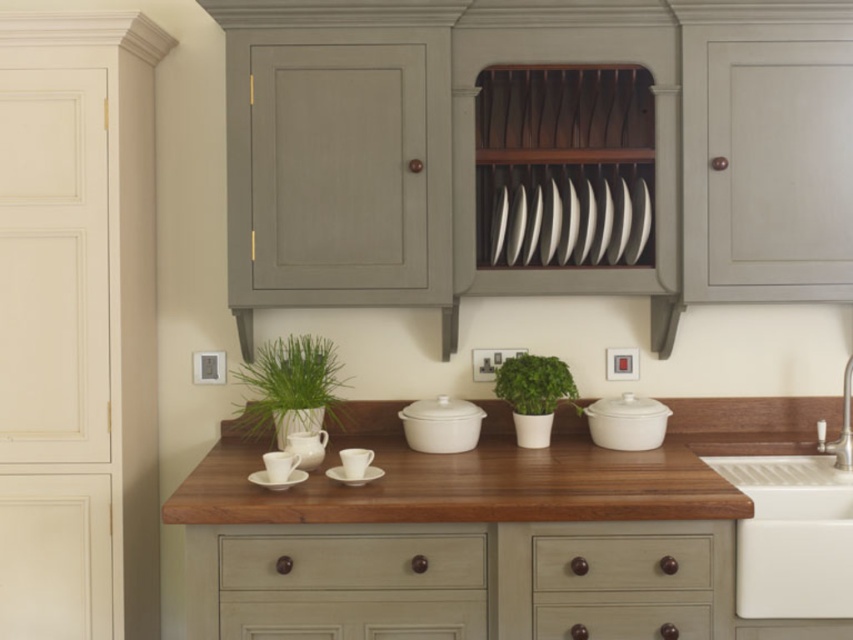
Locate an element on the screen. green matte plant at left is located at coordinates (289, 385).

Who is taller, green matte plant at left or green matte plant at center?

green matte plant at left

The width and height of the screenshot is (853, 640). Describe the element at coordinates (289, 385) in the screenshot. I see `green matte plant at left` at that location.

You are a GUI agent. You are given a task and a screenshot of the screen. Output one action in this format:
    pyautogui.click(x=<x>, y=<y>)
    Task: Click on the green matte plant at left
    This screenshot has width=853, height=640.
    Given the screenshot: What is the action you would take?
    pyautogui.click(x=289, y=385)

Consider the image. Is brown wood drawer at center to the right of green matte plant at left from the viewer's perspective?

Yes, brown wood drawer at center is to the right of green matte plant at left.

Is point (585, 563) positioned in front of point (253, 401)?

Yes, it is in front of point (253, 401).

Where is `brown wood drawer at center`? This screenshot has height=640, width=853. brown wood drawer at center is located at coordinates (619, 563).

Consider the image. Can you confirm if wooden at center is wider than white glossy plate at center?

Yes.

Who is more distant from viewer, (619, 464) or (590, 189)?

The point (590, 189) is behind.

Where is `wooden at center`? wooden at center is located at coordinates (479, 474).